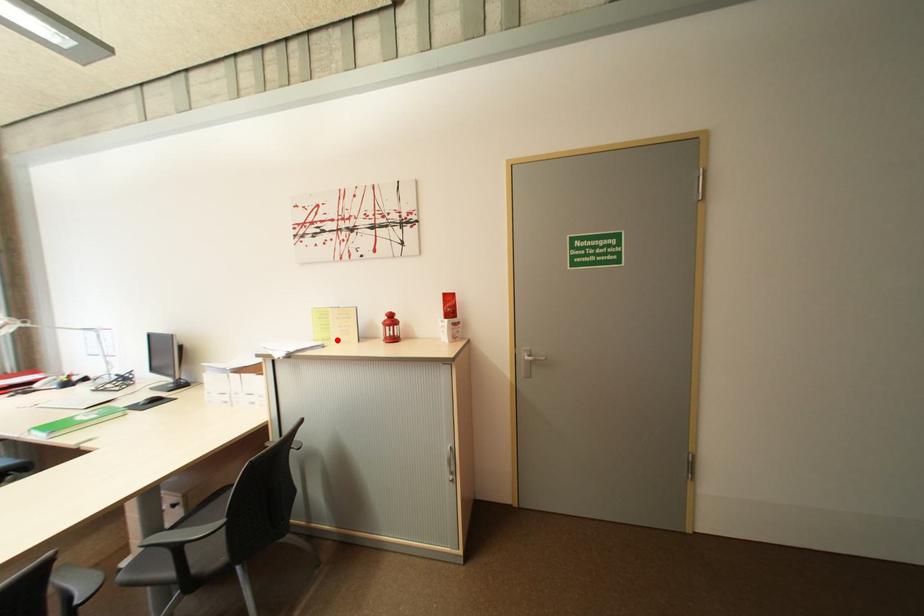
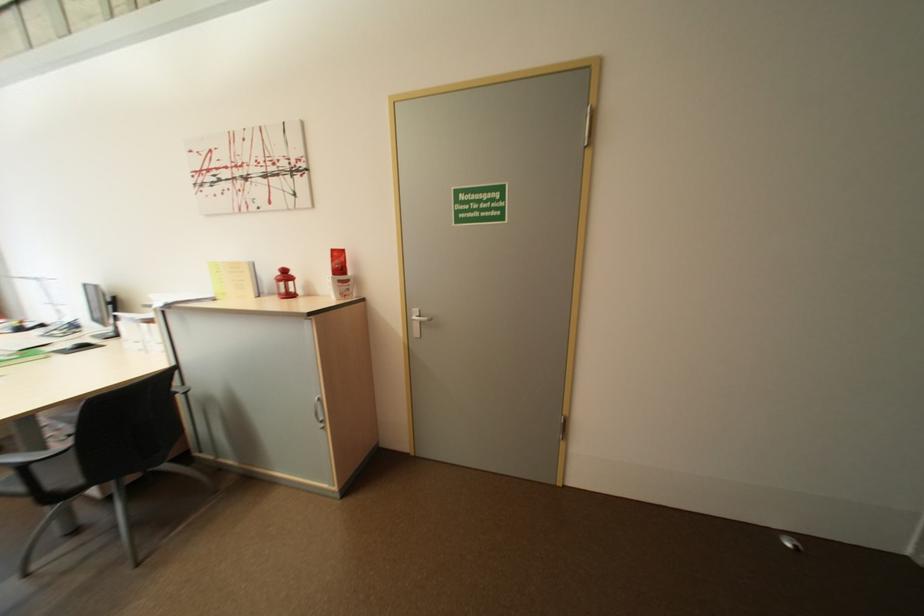
The point at the highlighted location is marked in the first image. Where is the corresponding point in the second image?

(234, 294)